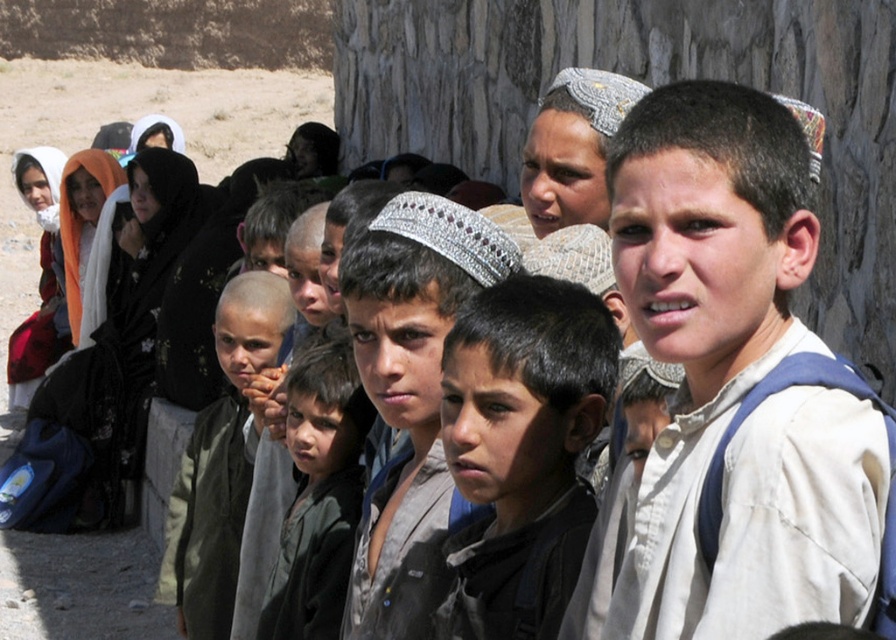
Can you confirm if shiny silver headband at center is taller than dark green fabric at center?

In fact, shiny silver headband at center may be shorter than dark green fabric at center.

Is the position of shiny silver headband at center less distant than that of dark green fabric at center?

Yes.

What are the coordinates of `shiny silver headband at center` in the screenshot? It's located at (408, 390).

Can you confirm if dark green jacket at center is positioned to the right of silver textured headband at center?

In fact, dark green jacket at center is to the left of silver textured headband at center.

From the picture: Can you confirm if dark green jacket at center is bigger than silver textured headband at center?

No, dark green jacket at center is not bigger than silver textured headband at center.

Locate an element on the screen. This screenshot has height=640, width=896. dark green jacket at center is located at coordinates (220, 461).

Which is below, dark brown hair at center or shiny silver headband at center?

Positioned lower is dark brown hair at center.

Image resolution: width=896 pixels, height=640 pixels. Describe the element at coordinates (521, 451) in the screenshot. I see `dark brown hair at center` at that location.

Is point (435, 620) positioned behind point (394, 342)?

No, (435, 620) is in front of (394, 342).

What are the coordinates of `dark brown hair at center` in the screenshot? It's located at (521, 451).